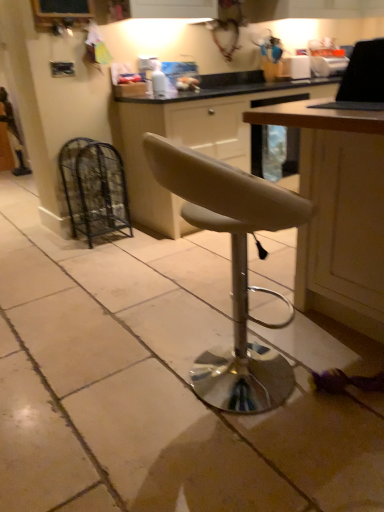
You are a GUI agent. You are given a task and a screenshot of the screen. Output one action in this format:
    pyautogui.click(x=<x>, y=<y>)
    Task: Click on the free space between beige leather stool at center and black wire mesh cage at left
    This screenshot has width=384, height=512.
    Given the screenshot: What is the action you would take?
    pyautogui.click(x=146, y=290)